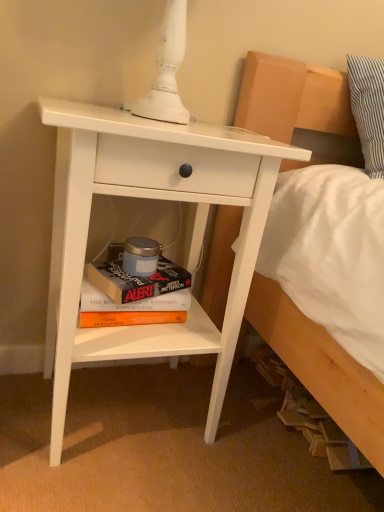
Question: In which direction should I rotate to look at hardcover book at lower center, which is the 1th paperback book from bottom to top?

Choices:
 (A) right
 (B) left

Answer: (B)

Question: From the image's perspective, would you say white matte nightstand at center-left is shown under hardcover book at lower center, acting as the second paperback book starting from the bottom?

Choices:
 (A) yes
 (B) no

Answer: (B)

Question: From the image's perspective, is white matte nightstand at center-left on hardcover book at lower center, the 1th paperback book viewed from the top?

Choices:
 (A) yes
 (B) no

Answer: (A)

Question: Considering the relative sizes of white matte nightstand at center-left and hardcover book at lower center, the 1th paperback book viewed from the top, in the image provided, is white matte nightstand at center-left smaller than hardcover book at lower center, the 1th paperback book viewed from the top,?

Choices:
 (A) no
 (B) yes

Answer: (A)

Question: Is white matte nightstand at center-left to the left of hardcover book at lower center, acting as the second paperback book starting from the bottom, from the viewer's perspective?

Choices:
 (A) yes
 (B) no

Answer: (B)

Question: From a real-world perspective, is white matte nightstand at center-left below hardcover book at lower center, acting as the second paperback book starting from the bottom?

Choices:
 (A) no
 (B) yes

Answer: (A)

Question: Does white matte nightstand at center-left have a larger size compared to hardcover book at lower center, the 1th paperback book viewed from the top?

Choices:
 (A) yes
 (B) no

Answer: (A)

Question: Are hardcover book at lower center, the 1th paperback book viewed from the top, and white matte nightstand at center-left far apart?

Choices:
 (A) no
 (B) yes

Answer: (A)

Question: Is white matte nightstand at center-left a part of hardcover book at lower center, the 1th paperback book viewed from the top?

Choices:
 (A) yes
 (B) no

Answer: (B)

Question: Is hardcover book at lower center, acting as the second paperback book starting from the bottom, positioned in front of white matte nightstand at center-left?

Choices:
 (A) no
 (B) yes

Answer: (A)

Question: From the image's perspective, is hardcover book at lower center, the 1th paperback book viewed from the top, above white matte nightstand at center-left?

Choices:
 (A) no
 (B) yes

Answer: (A)

Question: From the image's perspective, is hardcover book at lower center, acting as the second paperback book starting from the bottom, below white matte nightstand at center-left?

Choices:
 (A) no
 (B) yes

Answer: (B)

Question: Does hardcover book at lower center, acting as the second paperback book starting from the bottom, have a larger size compared to white matte nightstand at center-left?

Choices:
 (A) no
 (B) yes

Answer: (A)

Question: Is hardcover book at lower center, which appears as the second paperback book when viewed from the top, behind white matte nightstand at center-left?

Choices:
 (A) yes
 (B) no

Answer: (A)